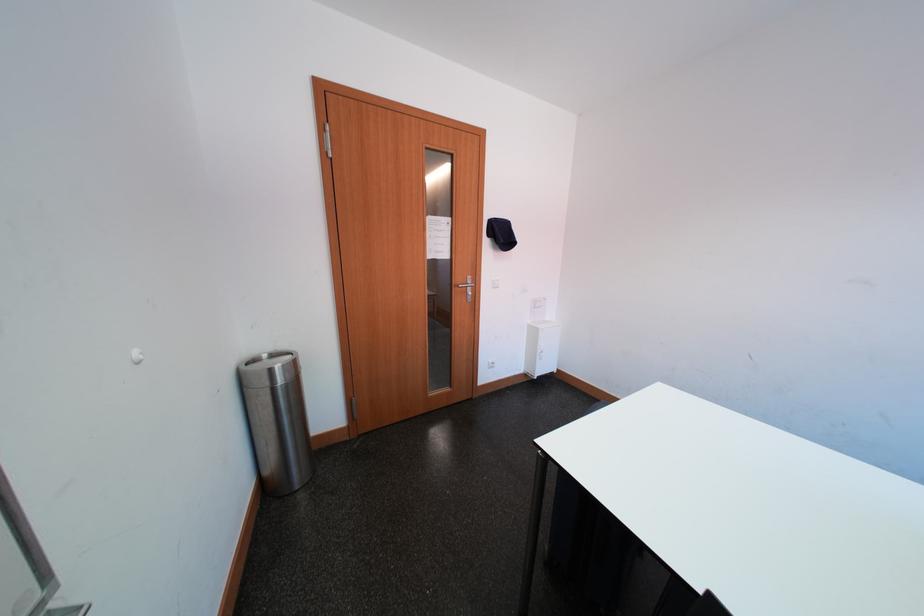
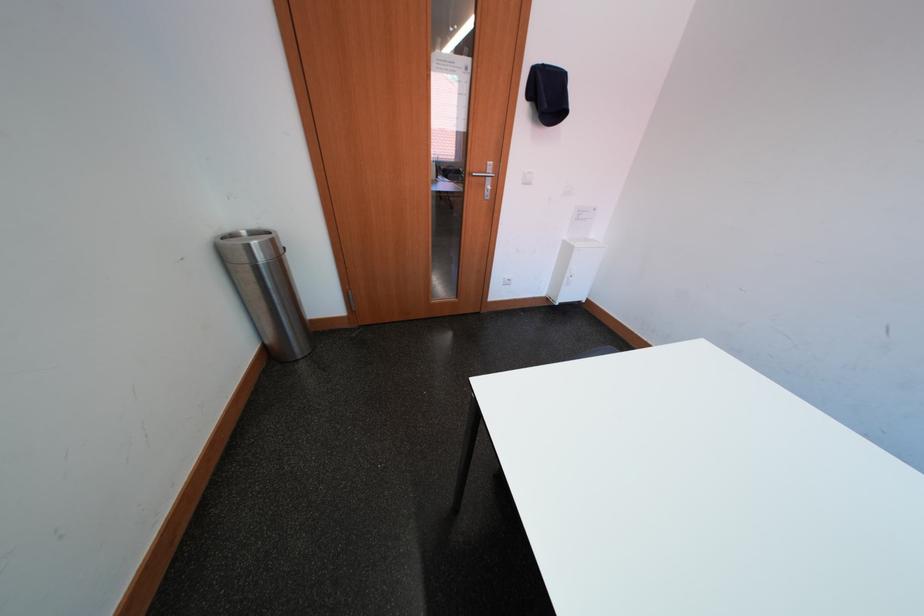
Question: The first image is from the beginning of the video and the second image is from the end. How did the camera likely rotate when shooting the video?

Choices:
 (A) Left
 (B) Right
 (C) Up
 (D) Down

Answer: (D)